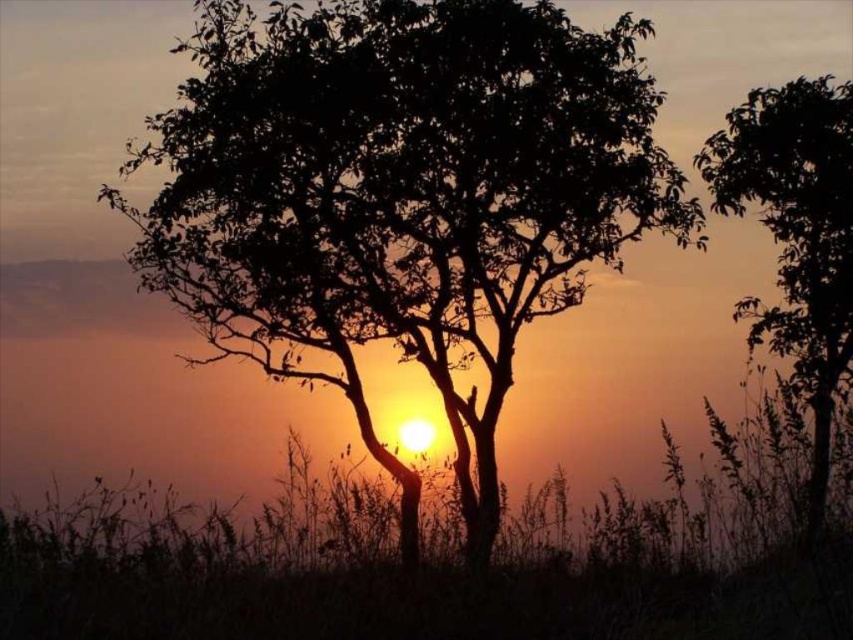
Which is behind, point (223, 33) or point (817, 307)?

Positioned behind is point (223, 33).

Is point (277, 234) less distant than point (842, 83)?

No.

Locate an element on the screen. This screenshot has width=853, height=640. silhouette leafy tree at center is located at coordinates (401, 192).